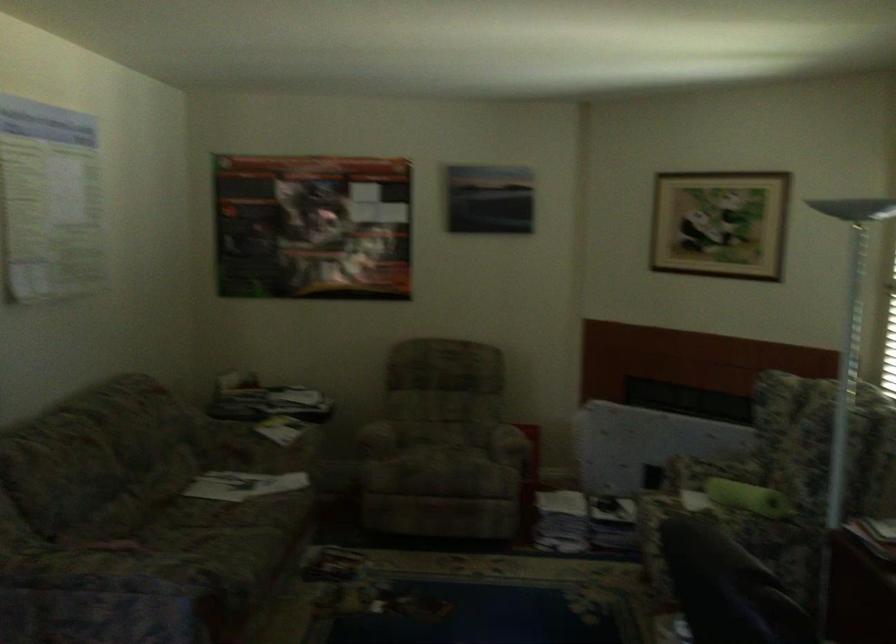
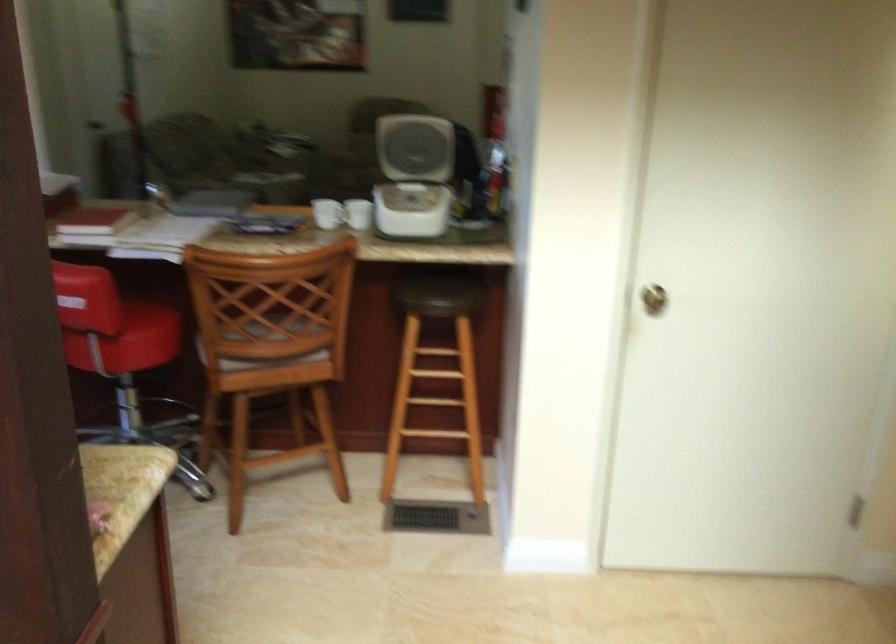
Question: I am providing you with two images of the same scene from different viewpoints. Please identify which objects are invisible in image2.

Choices:
 (A) bin handle
 (B) chair armrest
 (C) stool sitting surface
 (D) brass door knob

Answer: (B)